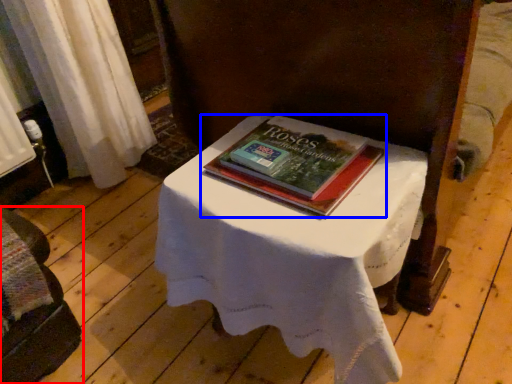
Question: Among these objects, which one is nearest to the camera, furniture (highlighted by a red box) or book (highlighted by a blue box)?

Choices:
 (A) furniture
 (B) book

Answer: (A)